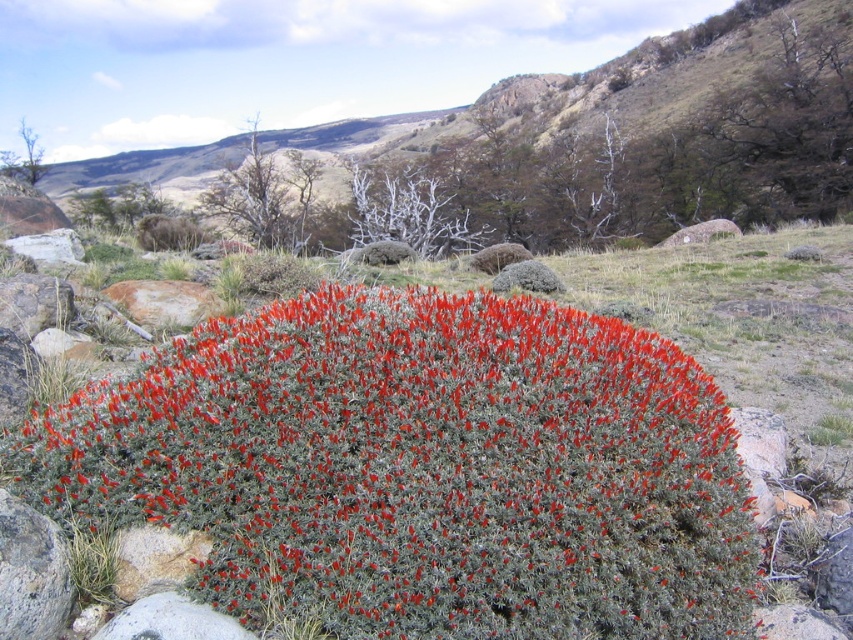
You are a hiker who wants to take a photo of the red fuzzy bush at center and the green grassy hillside at center. Which one should you focus on first if you want both to be in sharp focus?

The red fuzzy bush at center is shorter than the green grassy hillside at center, so you should focus on the green grassy hillside at center first to ensure both are in sharp focus.

You are a hiker who wants to take a photo of the red fuzzy bush at center and the green grassy hillside at center. Which object is closer to the camera?

The red fuzzy bush at center is closer to the camera because it is positioned under the green grassy hillside at center, meaning it is in front of it.

You are a hiker who wants to take a photo of the red fuzzy bush at center and the green grassy hillside at center. Which object should you focus on first if you want to capture both in the same frame without moving your camera?

The red fuzzy bush at center is positioned on the right side of green grassy hillside at center, so you should focus on the green grassy hillside at center first as it is closer to the camera, allowing both objects to be in focus within the same frame.